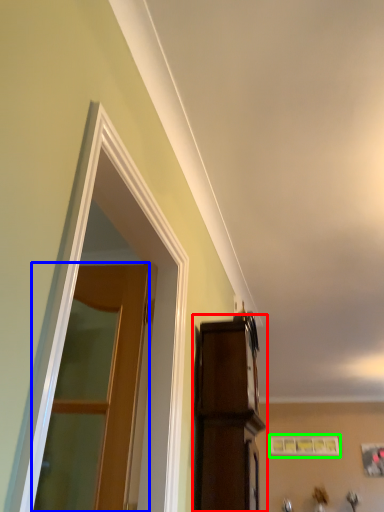
Question: Based on their relative distances, which object is nearer to cabinetry (highlighted by a red box)? Choose from door (highlighted by a blue box) and picture frame (highlighted by a green box).

Choices:
 (A) door
 (B) picture frame

Answer: (A)